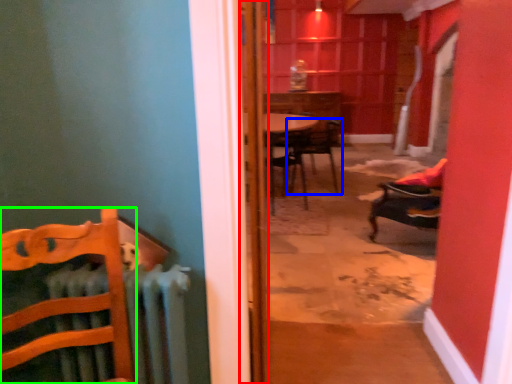
Question: Which object is positioned closest to door (highlighted by a red box)? Select from chair (highlighted by a blue box) and chair (highlighted by a green box).

Choices:
 (A) chair
 (B) chair

Answer: (B)